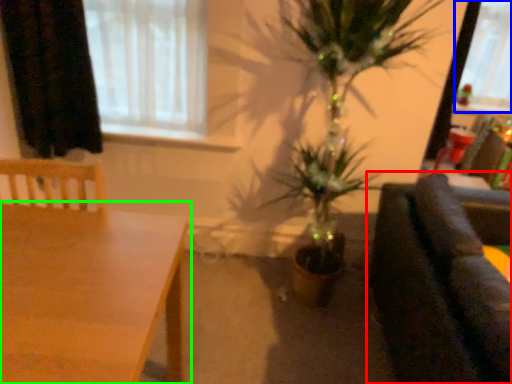
Question: Which is nearer to the studio couch (highlighted by a red box)? window screen (highlighted by a blue box) or table (highlighted by a green box).

Choices:
 (A) window screen
 (B) table

Answer: (B)